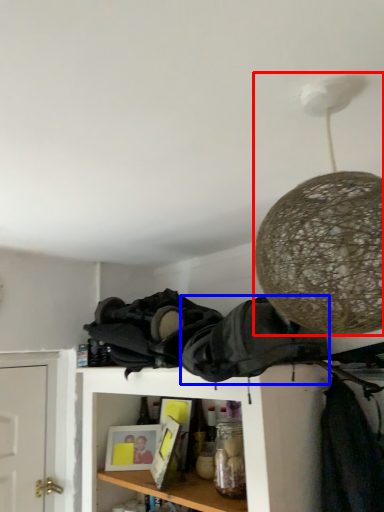
Question: Which of the following is the farthest to the observer, lamp (highlighted by a red box) or clothing (highlighted by a blue box)?

Choices:
 (A) lamp
 (B) clothing

Answer: (B)